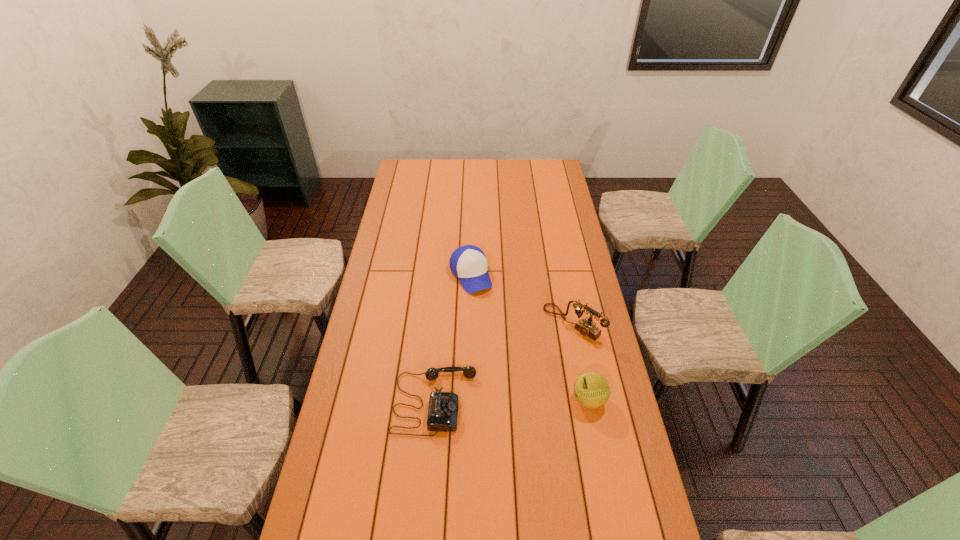
I want to click on free location located on the front-facing side of the farther telephone, so click(482, 410).

The image size is (960, 540). Find the location of `blank space located on the front-facing side of the farther telephone`. blank space located on the front-facing side of the farther telephone is located at coordinates (543, 350).

The height and width of the screenshot is (540, 960). What are the coordinates of `vacant space located 0.130m on the front-facing side of the farther telephone` in the screenshot? It's located at (535, 359).

The image size is (960, 540). In order to click on vacant region located 0.330m on the front-facing side of the farthest object in this screenshot , I will do `click(507, 359)`.

Image resolution: width=960 pixels, height=540 pixels. I want to click on vacant space located 0.400m on the front-facing side of the farthest object, so click(515, 375).

You are a GUI agent. You are given a task and a screenshot of the screen. Output one action in this format:
    pyautogui.click(x=<x>, y=<y>)
    Task: Click on the blank area located on the front-facing side of the farthest object
    The image size is (960, 540).
    Given the screenshot: What is the action you would take?
    pyautogui.click(x=492, y=325)

The image size is (960, 540). Find the location of `softball that is positioned at the right edge`. softball that is positioned at the right edge is located at coordinates (591, 389).

Where is `telephone that is at the right edge`? telephone that is at the right edge is located at coordinates pyautogui.click(x=586, y=327).

The height and width of the screenshot is (540, 960). Find the location of `vacant area at the far edge`. vacant area at the far edge is located at coordinates (492, 178).

In the image, there is a desktop. What are the coordinates of `free region at the near edge` in the screenshot? It's located at (408, 528).